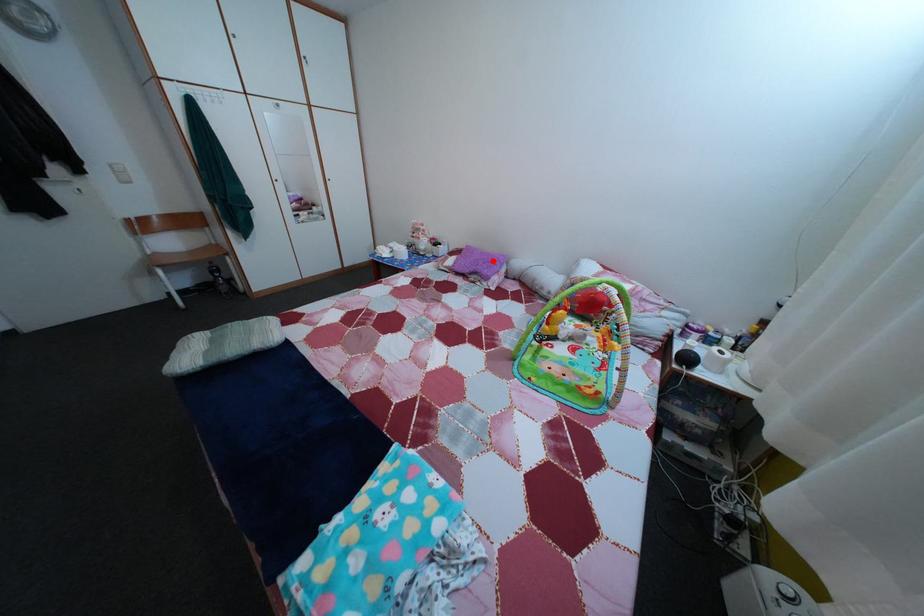
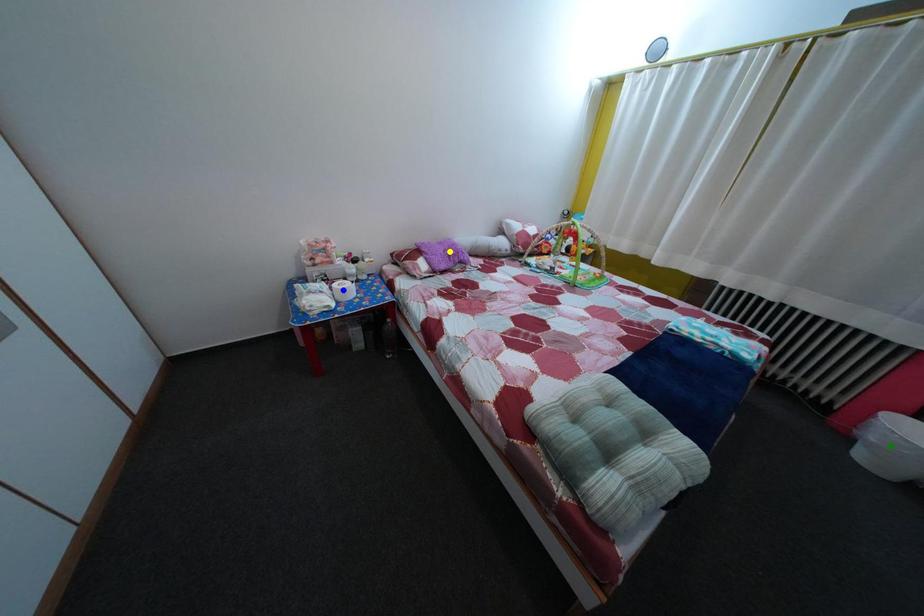
Question: I am providing you with two images of the same scene from different viewpoints. A red point is marked on the first image. You are given multiple points on the second image. Which point in image 2 represents the same 3d spot as the red point in image 1?

Choices:
 (A) blue point
 (B) yellow point
 (C) green point

Answer: (B)